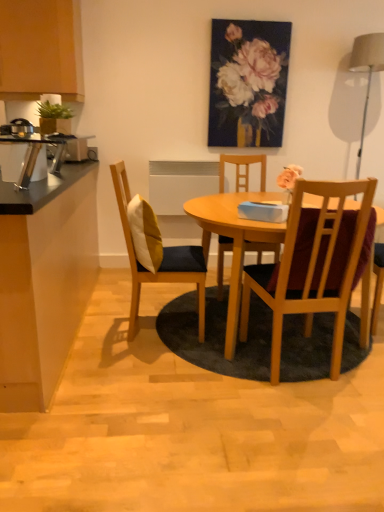
Locate an element on the screen. This screenshot has height=512, width=384. free space in front of wooden chair at center, which is the 1th chair in right-to-left order is located at coordinates (309, 414).